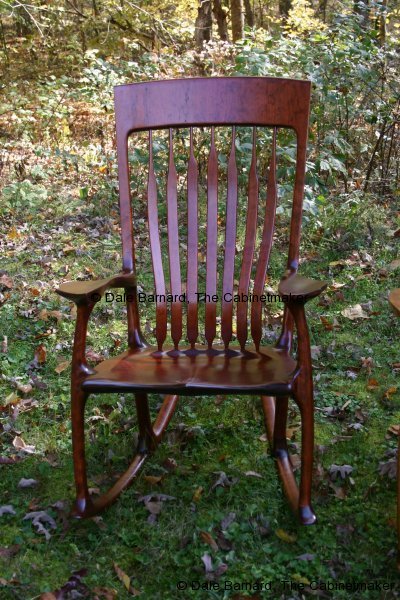
Locate an element on the screen. This screenshot has height=600, width=400. seat of rocking chair is located at coordinates (193, 367).